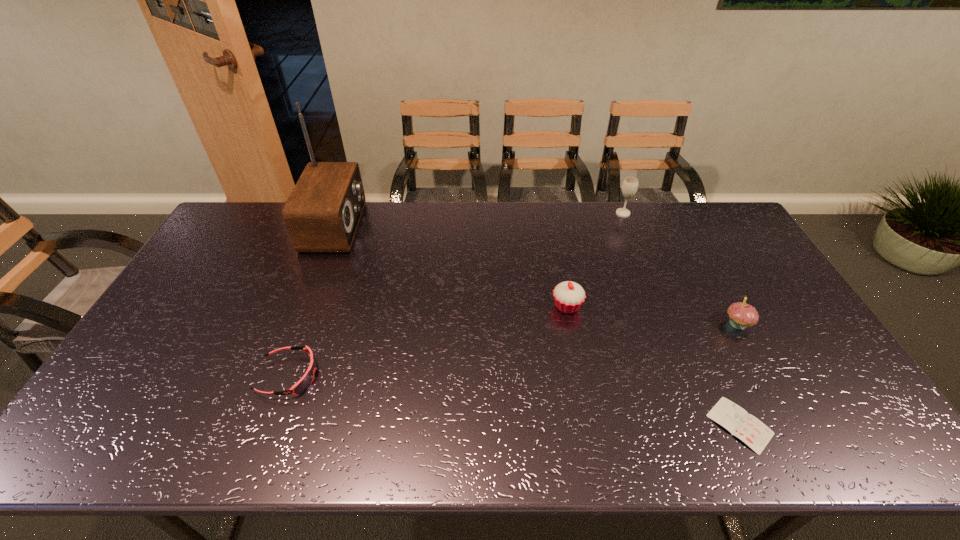
The width and height of the screenshot is (960, 540). Identify the location of free space located on the front-facing side of the fifth tallest object. (464, 376).

This screenshot has width=960, height=540. What are the coordinates of `free space located on the back of the shortest object` in the screenshot? It's located at (687, 308).

Where is `radio receiver present at the far edge`? The height and width of the screenshot is (540, 960). radio receiver present at the far edge is located at coordinates (322, 213).

I want to click on wineglass present at the far edge, so click(630, 185).

Identify the location of object that is at the near edge. (755, 434).

Find the location of a particular element. Image resolution: width=960 pixels, height=540 pixels. object that is at the right edge is located at coordinates (741, 315).

This screenshot has height=540, width=960. In order to click on vacant space at the far edge of the desktop in this screenshot , I will do `click(541, 226)`.

Where is `vacant space at the near edge`? vacant space at the near edge is located at coordinates (564, 446).

This screenshot has height=540, width=960. What are the coordinates of `free space at the left edge` in the screenshot? It's located at (203, 278).

At what (x,y) coordinates should I click in order to perform the action: click on free space at the right edge of the desktop. Please return your answer as a coordinate pair (x, y). This screenshot has height=540, width=960. Looking at the image, I should click on (719, 267).